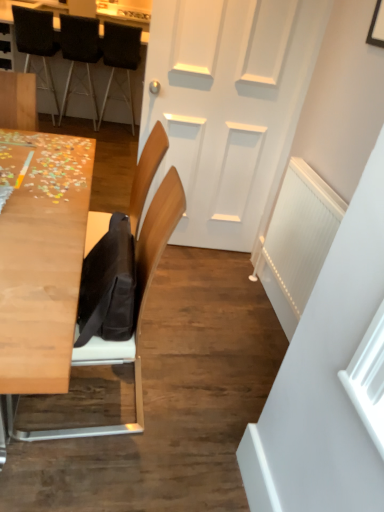
Locate an element on the screen. This screenshot has height=512, width=384. free region on the left part of white plastic radiator at right is located at coordinates (219, 298).